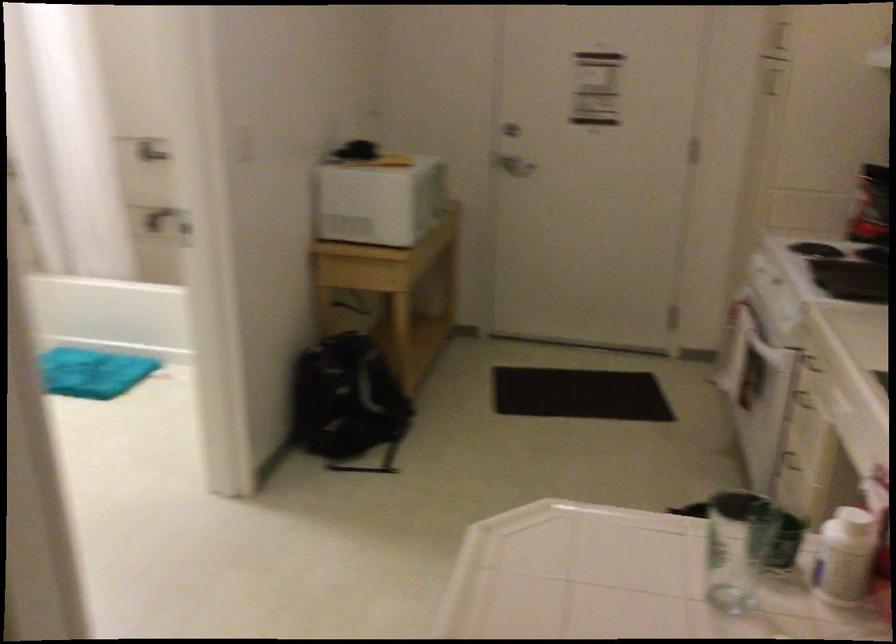
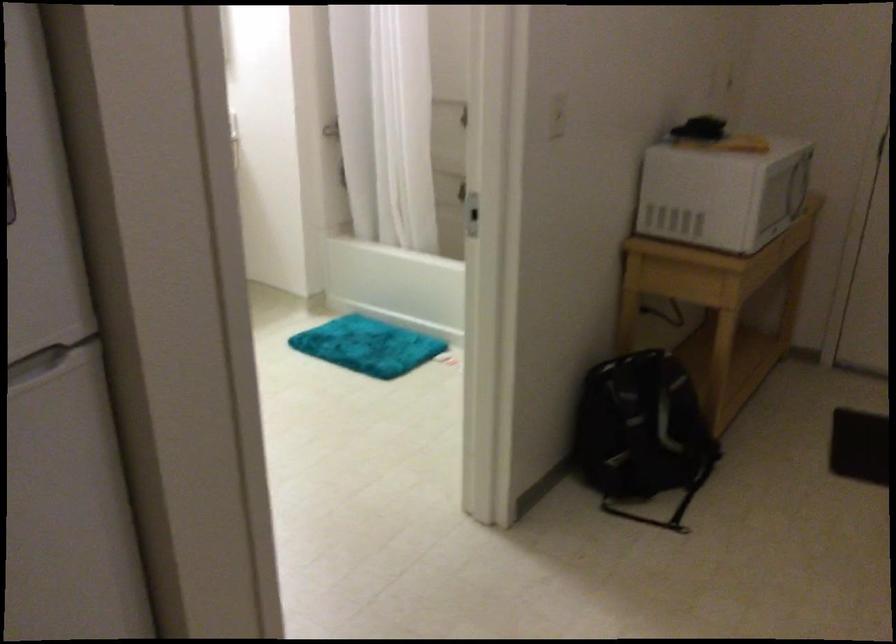
Question: How did the camera likely rotate?

Choices:
 (A) Left
 (B) Right
 (C) Up
 (D) Down

Answer: (A)